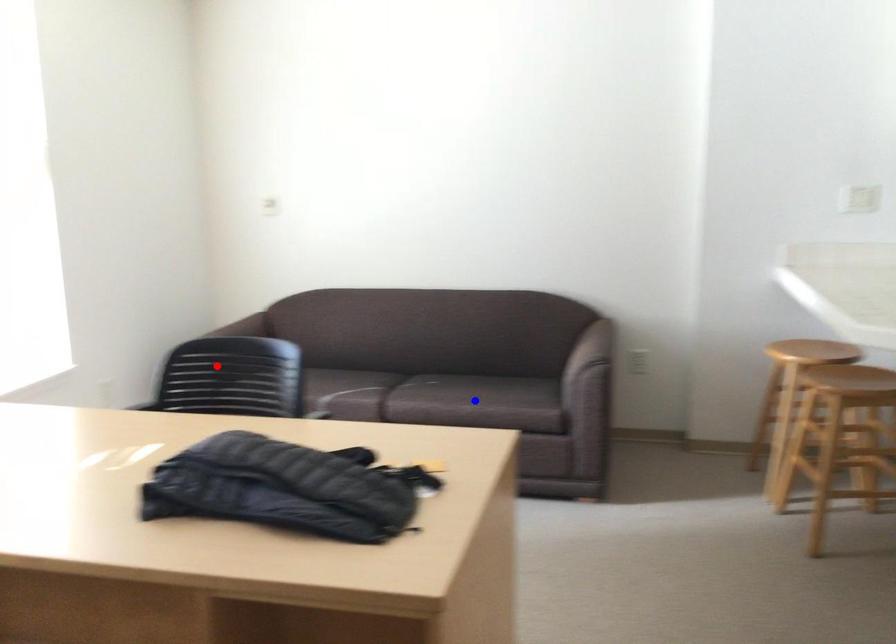
Question: In the image, two points are highlighted. Which point is nearer to the camera? Reply with the corresponding letter.

Choices:
 (A) blue point
 (B) red point

Answer: (B)